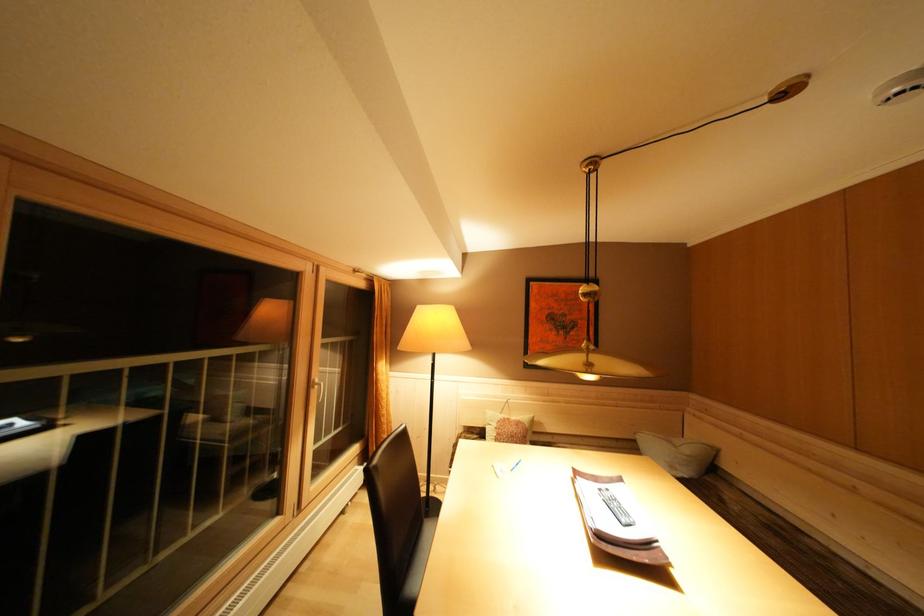
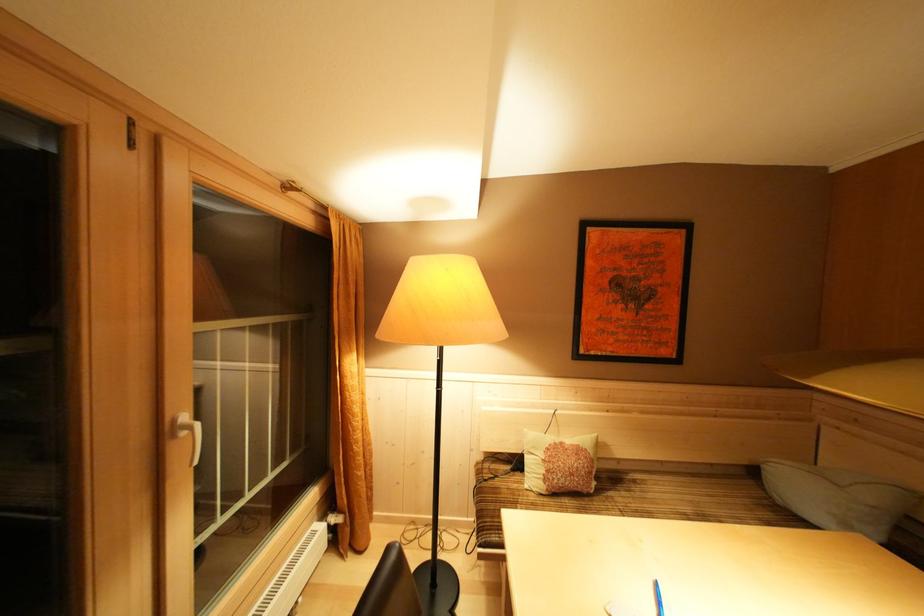
Where in the second image is the point corresponding to point 515,424 from the first image?

(568, 448)